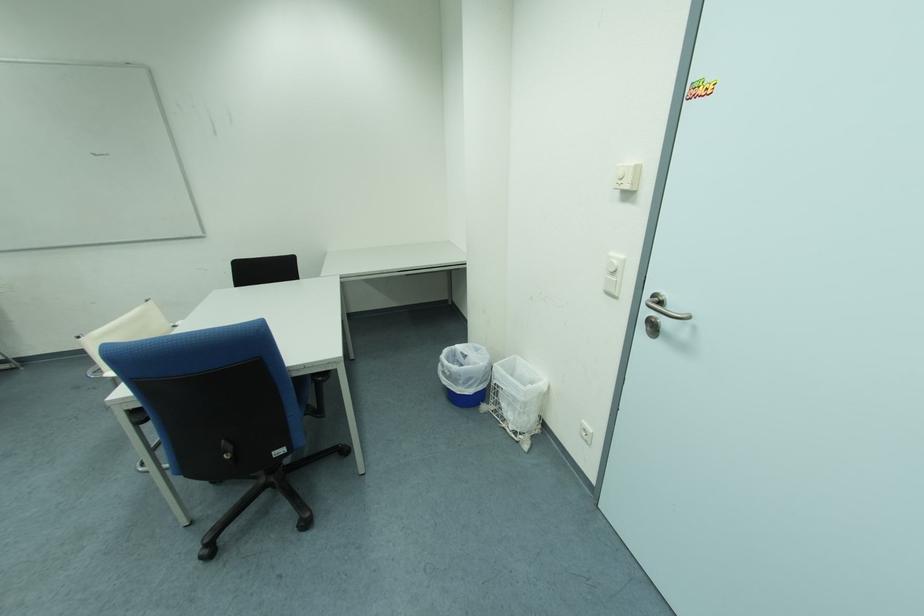
Where is `blue chair sitting surface`? The image size is (924, 616). blue chair sitting surface is located at coordinates (301, 387).